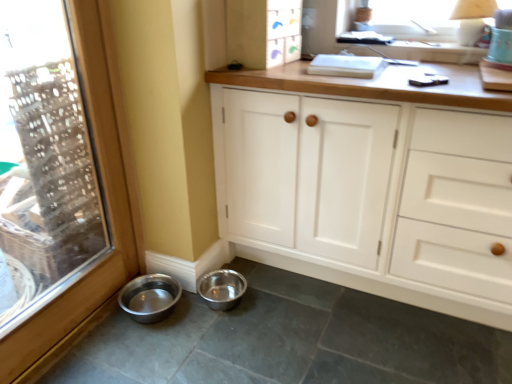
Image resolution: width=512 pixels, height=384 pixels. What do you see at coordinates (263, 32) in the screenshot? I see `white wood cabinet at upper center, which ranks as the 1th cabinetry in top-to-bottom order` at bounding box center [263, 32].

Find the location of a particular element. Image resolution: width=512 pixels, height=384 pixels. white wood cabinet at upper center, which ranks as the 1th cabinetry in top-to-bottom order is located at coordinates (263, 32).

This screenshot has height=384, width=512. I want to click on metal bowls at lower left, so click(290, 340).

At what (x,y) coordinates should I click in order to perform the action: click on metallic silver bowl at lower left, acting as the second basin starting from the left. Please return your answer as a coordinate pair (x, y). The width and height of the screenshot is (512, 384). Looking at the image, I should click on pos(222,289).

In the image, is white wood cabinet at center, the second cabinetry from the top, on the left side or the right side of metallic silver bowl at lower left, the first basin in the right-to-left sequence?

In the image, white wood cabinet at center, the second cabinetry from the top, appears on the right side of metallic silver bowl at lower left, the first basin in the right-to-left sequence.

Are white wood cabinet at center, the second cabinetry from the top, and metallic silver bowl at lower left, the first basin in the right-to-left sequence, making contact?

No, white wood cabinet at center, the second cabinetry from the top, is not touching metallic silver bowl at lower left, the first basin in the right-to-left sequence.

Measure the distance between white wood cabinet at center, the 1th cabinetry from the bottom, and metallic silver bowl at lower left, the first basin in the right-to-left sequence.

white wood cabinet at center, the 1th cabinetry from the bottom, is 26.07 inches away from metallic silver bowl at lower left, the first basin in the right-to-left sequence.

Between white wood cabinet at center, the 1th cabinetry from the bottom, and metallic silver bowl at lower left, the first basin in the right-to-left sequence, which one has less height?

Standing shorter between the two is metallic silver bowl at lower left, the first basin in the right-to-left sequence.

Which of these two, white wood cabinet at center, the second cabinetry from the top, or white wood cabinet at upper center, positioned as the second cabinetry in bottom-to-top order, is bigger?

white wood cabinet at center, the second cabinetry from the top, is bigger.

From the image's perspective, between white wood cabinet at center, the second cabinetry from the top, and white wood cabinet at upper center, positioned as the second cabinetry in bottom-to-top order, which one is located above?

white wood cabinet at upper center, positioned as the second cabinetry in bottom-to-top order.

You are a GUI agent. You are given a task and a screenshot of the screen. Output one action in this format:
    pyautogui.click(x=<x>, y=<y>)
    Task: Click on the cabinetry on the right of white wood cabinet at upper center, which ranks as the 1th cabinetry in top-to-bottom order
    The height and width of the screenshot is (384, 512).
    Given the screenshot: What is the action you would take?
    pyautogui.click(x=398, y=184)

Considering their positions, is white wood cabinet at center, the 1th cabinetry from the bottom, located in front of or behind white wood cabinet at upper center, positioned as the second cabinetry in bottom-to-top order?

Visually, white wood cabinet at center, the 1th cabinetry from the bottom, is located in front of white wood cabinet at upper center, positioned as the second cabinetry in bottom-to-top order.

Where is `concrete that appears below the white wood cabinet at center, the second cabinetry from the top (from a real-world perspective)`? The height and width of the screenshot is (384, 512). concrete that appears below the white wood cabinet at center, the second cabinetry from the top (from a real-world perspective) is located at coordinates (290, 340).

Considering the positions of objects white wood cabinet at center, the 1th cabinetry from the bottom, and metal bowls at lower left in the image provided, who is behind, white wood cabinet at center, the 1th cabinetry from the bottom, or metal bowls at lower left?

white wood cabinet at center, the 1th cabinetry from the bottom, is more distant.

From the image's perspective, relative to metal bowls at lower left, is white wood cabinet at center, the second cabinetry from the top, above or below?

Clearly, from the image's perspective, white wood cabinet at center, the second cabinetry from the top, is above metal bowls at lower left.

Which object is positioned more to the left, white wood cabinet at center, the second cabinetry from the top, or metal bowls at lower left?

From the viewer's perspective, metal bowls at lower left appears more on the left side.

From the image's perspective, relative to white wood cabinet at upper center, positioned as the second cabinetry in bottom-to-top order, is metal bowls at lower left above or below?

metal bowls at lower left is below white wood cabinet at upper center, positioned as the second cabinetry in bottom-to-top order.

Does metal bowls at lower left have a larger size compared to white wood cabinet at upper center, positioned as the second cabinetry in bottom-to-top order?

Yes, metal bowls at lower left is bigger than white wood cabinet at upper center, positioned as the second cabinetry in bottom-to-top order.

Is metal bowls at lower left turned away from white wood cabinet at upper center, positioned as the second cabinetry in bottom-to-top order?

metal bowls at lower left is not turned away from white wood cabinet at upper center, positioned as the second cabinetry in bottom-to-top order.

Considering the positions of point (314, 292) and point (256, 43), is point (314, 292) closer or farther from the camera than point (256, 43)?

Point (314, 292) is farther from the camera than point (256, 43).

Is white wood cabinet at upper center, which ranks as the 1th cabinetry in top-to-bottom order, beside metal bowls at lower left?

No.

Is white wood cabinet at upper center, which ranks as the 1th cabinetry in top-to-bottom order, facing towards metal bowls at lower left?

No, white wood cabinet at upper center, which ranks as the 1th cabinetry in top-to-bottom order, is not facing towards metal bowls at lower left.

Who is more distant, white wood cabinet at upper center, positioned as the second cabinetry in bottom-to-top order, or metal bowls at lower left?

Positioned behind is white wood cabinet at upper center, positioned as the second cabinetry in bottom-to-top order.

Can you tell me how much white wood cabinet at upper center, which ranks as the 1th cabinetry in top-to-bottom order, and metal bowls at lower left differ in facing direction?

There is a 85.2-degree angle between the facing directions of white wood cabinet at upper center, which ranks as the 1th cabinetry in top-to-bottom order, and metal bowls at lower left.

From the image's perspective, which one is positioned lower, metallic silver bowl at lower left, the 2th basin viewed from the right, or white wood cabinet at upper center, positioned as the second cabinetry in bottom-to-top order?

metallic silver bowl at lower left, the 2th basin viewed from the right, from the image's perspective.

Considering their positions, is metallic silver bowl at lower left, which is counted as the first basin, starting from the left, located in front of or behind white wood cabinet at upper center, which ranks as the 1th cabinetry in top-to-bottom order?

metallic silver bowl at lower left, which is counted as the first basin, starting from the left, is positioned farther from the viewer than white wood cabinet at upper center, which ranks as the 1th cabinetry in top-to-bottom order.

What's the angular difference between metallic silver bowl at lower left, which is counted as the first basin, starting from the left, and white wood cabinet at upper center, which ranks as the 1th cabinetry in top-to-bottom order,'s facing directions?

metallic silver bowl at lower left, which is counted as the first basin, starting from the left, and white wood cabinet at upper center, which ranks as the 1th cabinetry in top-to-bottom order, are facing 4.75 degrees away from each other.

Can you tell me how much metal bowls at lower left and metallic silver bowl at lower left, acting as the second basin starting from the left, differ in facing direction?

metal bowls at lower left and metallic silver bowl at lower left, acting as the second basin starting from the left, are facing 90 degrees away from each other.

Is metal bowls at lower left positioned beyond the bounds of metallic silver bowl at lower left, the first basin in the right-to-left sequence?

Answer: Absolutely, metal bowls at lower left is external to metallic silver bowl at lower left, the first basin in the right-to-left sequence.

Are metal bowls at lower left and metallic silver bowl at lower left, acting as the second basin starting from the left, far apart?

They are positioned close to each other.

From a real-world perspective, is metal bowls at lower left on top of metallic silver bowl at lower left, acting as the second basin starting from the left?

Incorrect, from a real-world perspective, metal bowls at lower left is lower than metallic silver bowl at lower left, acting as the second basin starting from the left.

Which cabinetry is the 2nd one when counting from the front of the metallic silver bowl at lower left, the first basin in the right-to-left sequence? Please provide its 2D coordinates.

[(398, 184)]

Identify the location of cabinetry beneath the white wood cabinet at upper center, which ranks as the 1th cabinetry in top-to-bottom order (from a real-world perspective). (398, 184).

From the image, which object appears to be farther from white wood cabinet at upper center, positioned as the second cabinetry in bottom-to-top order, white wood cabinet at center, the second cabinetry from the top, or transparent glass window at left?

transparent glass window at left is positioned further to the anchor white wood cabinet at upper center, positioned as the second cabinetry in bottom-to-top order.

Based on their spatial positions, is white wood cabinet at upper center, which ranks as the 1th cabinetry in top-to-bottom order, or transparent glass window at left further from metal bowls at lower left?

white wood cabinet at upper center, which ranks as the 1th cabinetry in top-to-bottom order, is positioned further to the anchor metal bowls at lower left.

Looking at the image, which one is located closer to transparent glass window at left, white wood cabinet at center, the 1th cabinetry from the bottom, or metallic silver bowl at lower left, the first basin in the right-to-left sequence?

metallic silver bowl at lower left, the first basin in the right-to-left sequence, is closer to transparent glass window at left.

Looking at the image, which one is located closer to white wood cabinet at center, the 1th cabinetry from the bottom, metallic silver bowl at lower left, the first basin in the right-to-left sequence, or metallic silver bowl at lower left, the 2th basin viewed from the right?

metallic silver bowl at lower left, the first basin in the right-to-left sequence, is closer to white wood cabinet at center, the 1th cabinetry from the bottom.

Considering their positions, is white wood cabinet at upper center, which ranks as the 1th cabinetry in top-to-bottom order, positioned closer to white wood cabinet at center, the second cabinetry from the top, than metal bowls at lower left?

metal bowls at lower left lies closer to white wood cabinet at center, the second cabinetry from the top, than the other object.

In the scene shown: From the image, which object appears to be nearer to metallic silver bowl at lower left, the 2th basin viewed from the right, metal bowls at lower left or transparent glass window at left?

transparent glass window at left lies closer to metallic silver bowl at lower left, the 2th basin viewed from the right, than the other object.

Estimate the real-world distances between objects in this image. Which object is closer to transparent glass window at left, metal bowls at lower left or white wood cabinet at center, the 1th cabinetry from the bottom?

Based on the image, metal bowls at lower left appears to be nearer to transparent glass window at left.

When comparing their distances from transparent glass window at left, does white wood cabinet at center, the 1th cabinetry from the bottom, or metallic silver bowl at lower left, which is counted as the first basin, starting from the left, seem closer?

Among the two, metallic silver bowl at lower left, which is counted as the first basin, starting from the left, is located nearer to transparent glass window at left.

Find the location of `concrete located between transparent glass window at left and metallic silver bowl at lower left, the 2th basin viewed from the right, in the depth direction`. concrete located between transparent glass window at left and metallic silver bowl at lower left, the 2th basin viewed from the right, in the depth direction is located at coordinates (290, 340).

Find the location of `concrete located between transparent glass window at left and white wood cabinet at center, the 1th cabinetry from the bottom, in the left-right direction`. concrete located between transparent glass window at left and white wood cabinet at center, the 1th cabinetry from the bottom, in the left-right direction is located at coordinates (290, 340).

You are a GUI agent. You are given a task and a screenshot of the screen. Output one action in this format:
    pyautogui.click(x=<x>, y=<y>)
    Task: Click on the concrete positioned between transparent glass window at left and metallic silver bowl at lower left, acting as the second basin starting from the left, from near to far
    The width and height of the screenshot is (512, 384).
    Given the screenshot: What is the action you would take?
    pyautogui.click(x=290, y=340)

Locate an element on the screen. The image size is (512, 384). cabinetry between transparent glass window at left and white wood cabinet at center, the second cabinetry from the top, in the horizontal direction is located at coordinates [x=263, y=32].